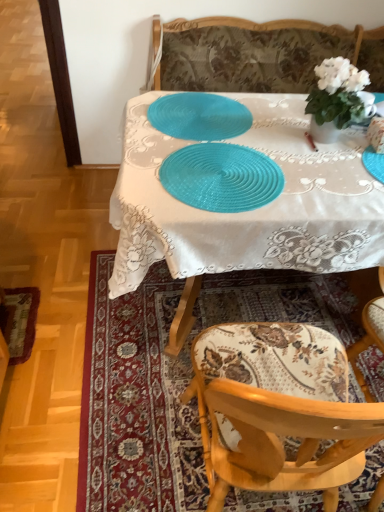
Where is `vacant space that is in between white glossy vase at upper right and teal woven placemat at center, acting as the first tableware starting from the bottom`? This screenshot has height=512, width=384. vacant space that is in between white glossy vase at upper right and teal woven placemat at center, acting as the first tableware starting from the bottom is located at coordinates (293, 155).